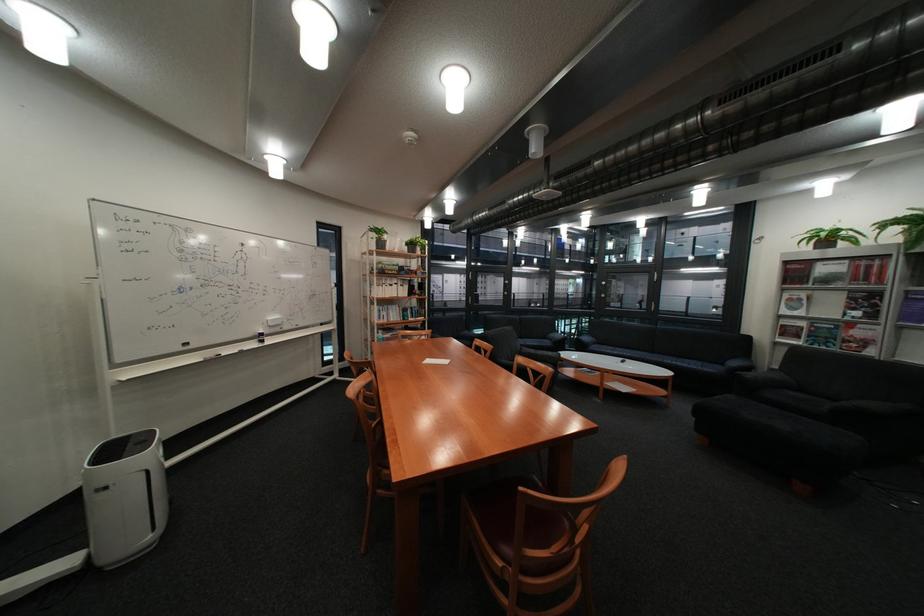
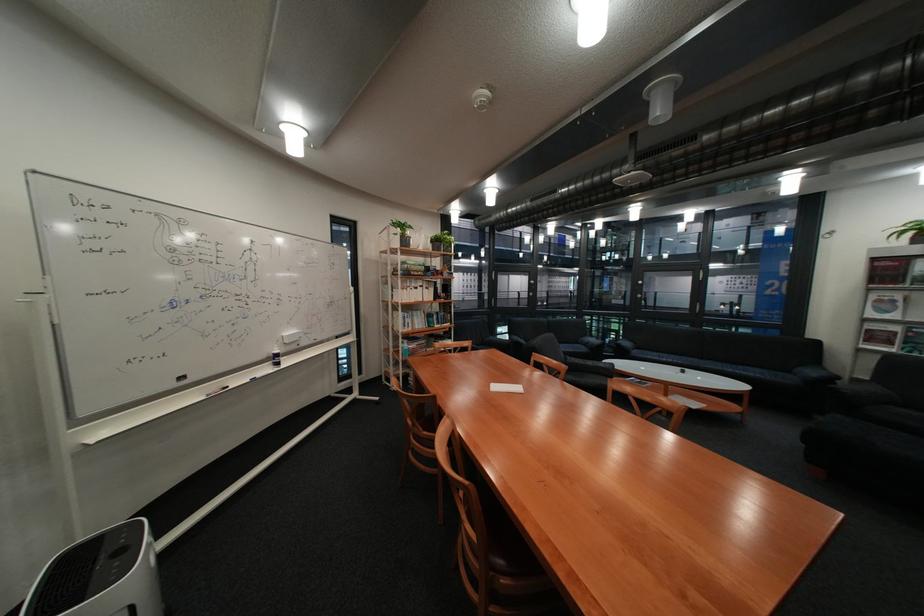
The images are taken continuously from a first-person perspective. In which direction are you moving?

The cameraman moved toward left, forward.